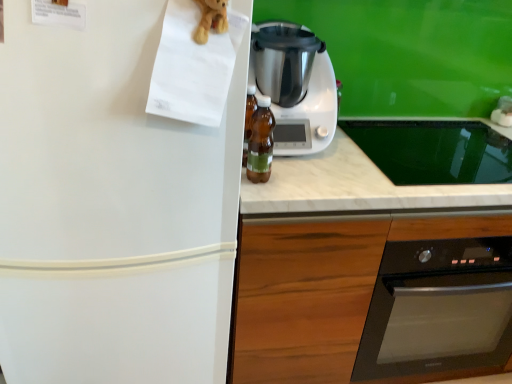
Question: Is translucent amber bottle at center in front of or behind white marble countertop at center in the image?

Choices:
 (A) front
 (B) behind

Answer: (A)

Question: Looking at the image, does translucent amber bottle at center seem bigger or smaller compared to white marble countertop at center?

Choices:
 (A) small
 (B) big

Answer: (A)

Question: Considering the real-world distances, which object is closest to the white marble countertop at center?

Choices:
 (A) brown plush toy at upper left
 (B) white plastic blender at center
 (C) white matte refrigerator at left
 (D) wooden at center
 (E) translucent amber bottle at center

Answer: (B)

Question: Which object is the closest to the white plastic blender at center?

Choices:
 (A) brown plush toy at upper left
 (B) translucent amber bottle at center
 (C) wooden at center
 (D) white matte refrigerator at left
 (E) white marble countertop at center

Answer: (B)